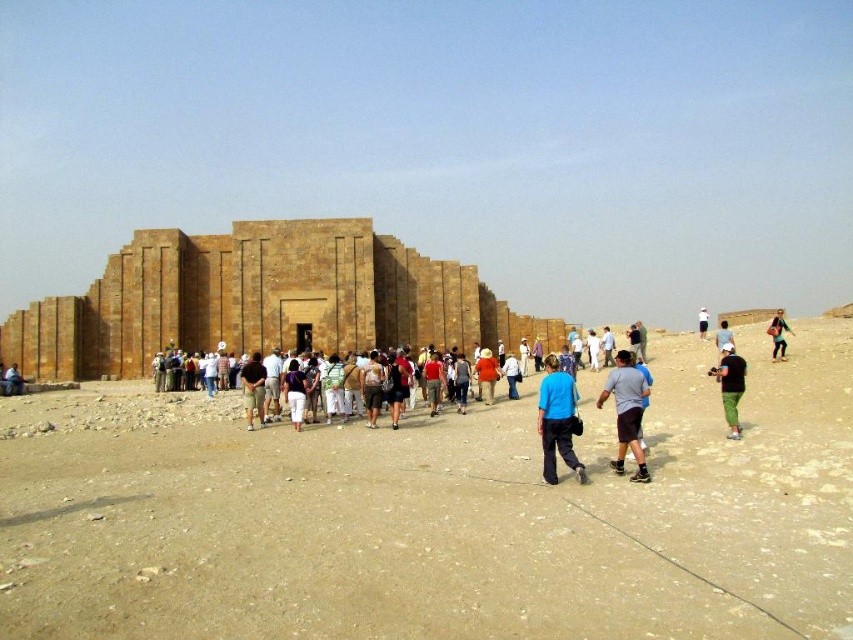
Question: Which of these objects is positioned closest to the blue fabric pants at center?

Choices:
 (A) brown stone desert at center
 (B) green fabric pants at right
 (C) matte brown stone person at lower left
 (D) dark brown leather pants at center

Answer: (A)

Question: Which point appears farthest from the camera in this image?

Choices:
 (A) (239, 508)
 (B) (769, 321)
 (C) (552, 458)
 (D) (259, 394)

Answer: (B)

Question: Is blue fabric pants at center further to camera compared to white fabric hat at center?

Choices:
 (A) yes
 (B) no

Answer: (B)

Question: Does black cotton shirt at center lie in front of white fabric hat at center?

Choices:
 (A) no
 (B) yes

Answer: (B)

Question: Which of the following is the farthest from the observer?

Choices:
 (A) dark brown leather pants at center
 (B) light blue shirt at center
 (C) brown stone pyramid at center

Answer: (C)

Question: Can you confirm if black cotton shirt at center is smaller than dark brown leather pants at center?

Choices:
 (A) no
 (B) yes

Answer: (A)